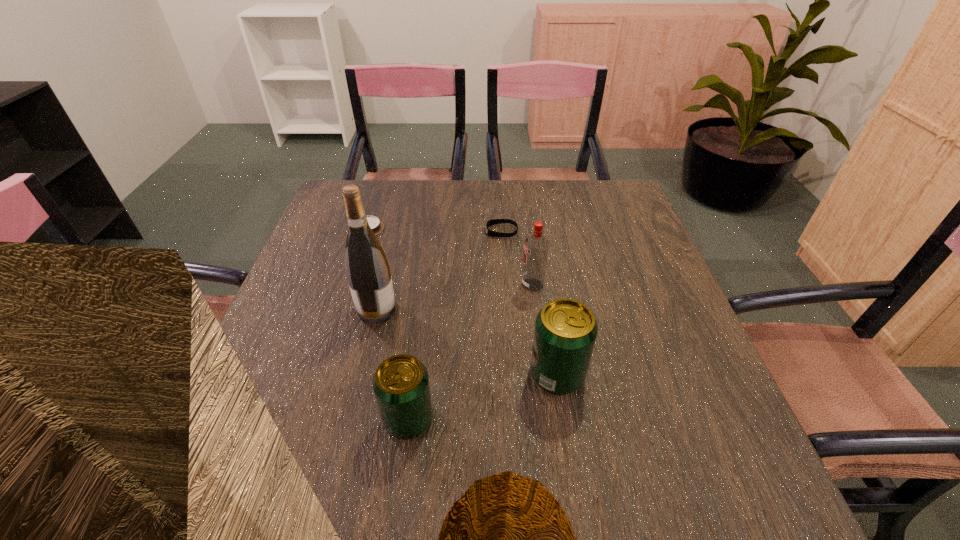
Please point a spot on the right to add another beer can. Please provide its 2D coordinates. Your answer should be formatted as a tuple, i.e. [(x, y)], where the tuple contains the x and y coordinates of a point satisfying the conditions above.

[(684, 336)]